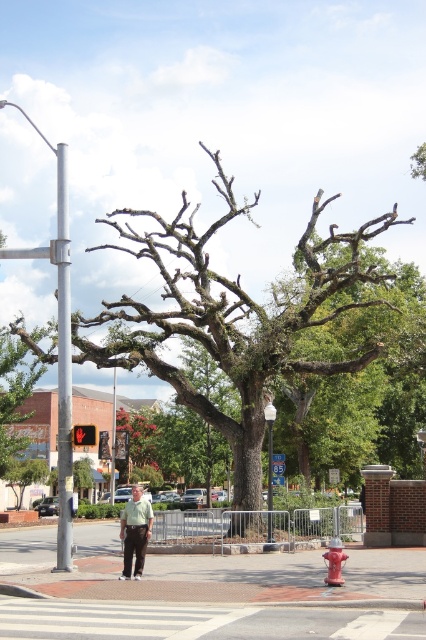
Question: Can you confirm if white asphalt at center is bigger than red glass traffic light at upper left?

Choices:
 (A) yes
 (B) no

Answer: (B)

Question: Which of the following is the closest to the observer?

Choices:
 (A) red glass traffic light at upper left
 (B) green mossy oak tree at center

Answer: (A)

Question: Based on their relative distances, which object is nearer to the red glass traffic light at upper left?

Choices:
 (A) red matte fire hydrant at lower right
 (B) white asphalt at center
 (C) light green shirt at center
 (D) green mossy oak tree at center

Answer: (C)

Question: Does white asphalt at center have a lesser width compared to red matte fire hydrant at lower right?

Choices:
 (A) yes
 (B) no

Answer: (B)

Question: Can you confirm if red matte fire hydrant at lower right is smaller than red glass traffic light at upper left?

Choices:
 (A) no
 (B) yes

Answer: (B)

Question: Which of the following is the closest to the observer?

Choices:
 (A) light green shirt at center
 (B) red glass traffic light at upper left

Answer: (A)